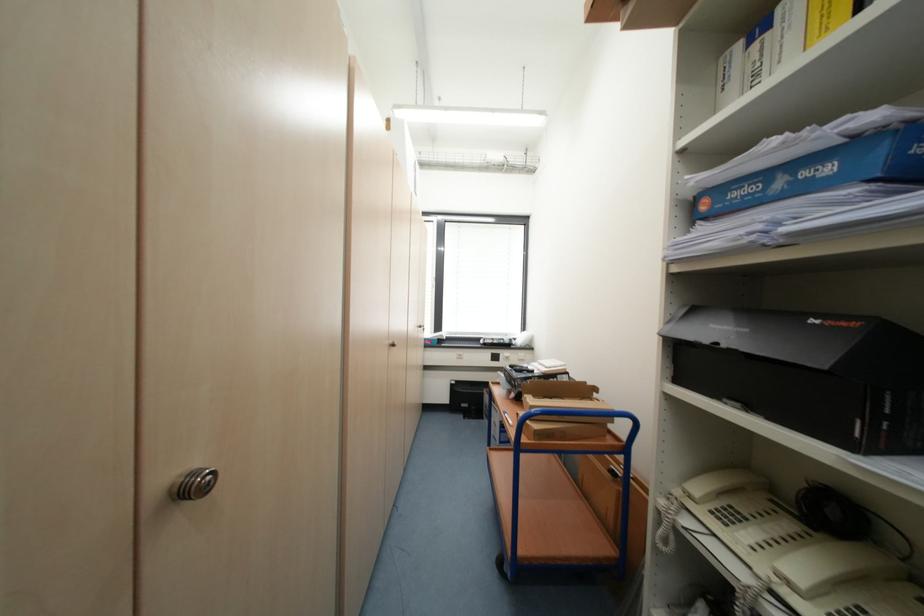
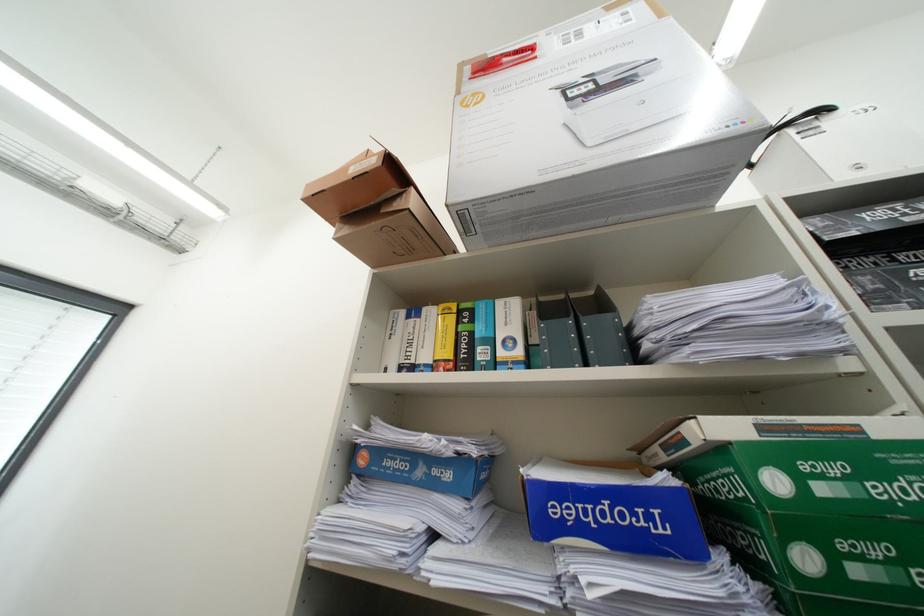
The images are taken continuously from a first-person perspective. In which direction is your viewpoint rotating?

The camera's rotation is toward right-up.